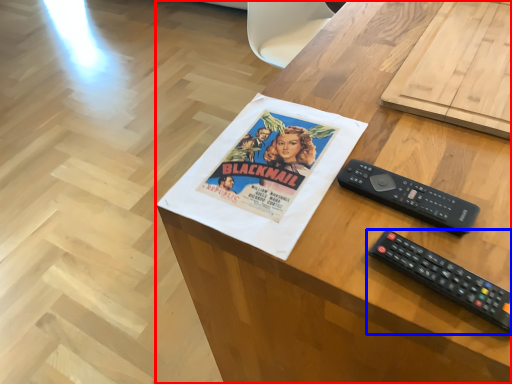
Question: Which of the following is the farthest to the observer, desk (highlighted by a red box) or remote control (highlighted by a blue box)?

Choices:
 (A) desk
 (B) remote control

Answer: (B)